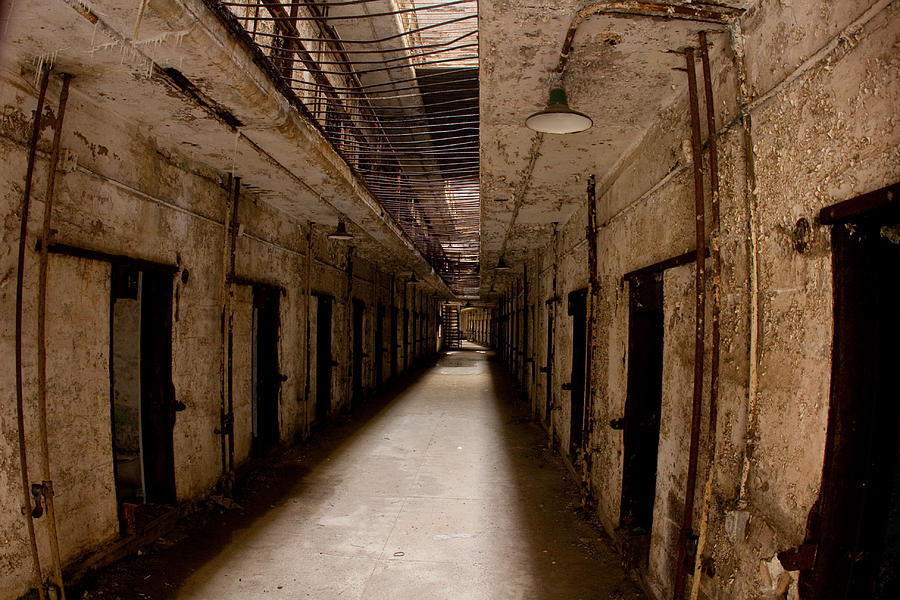
Locate an element on the screen. The width and height of the screenshot is (900, 600). ladder is located at coordinates (454, 329).